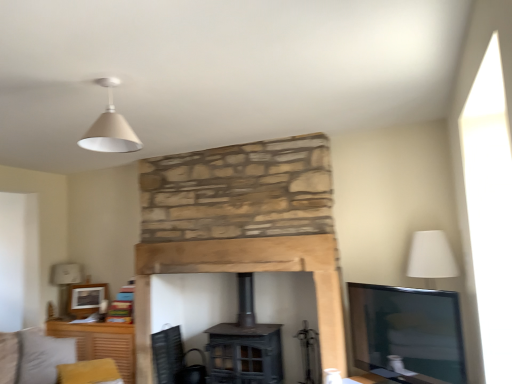
Where is `light gray fabric couch at lower left`? The image size is (512, 384). light gray fabric couch at lower left is located at coordinates (33, 356).

The height and width of the screenshot is (384, 512). Find the location of `matte wooden picture frame at upper left`. matte wooden picture frame at upper left is located at coordinates (86, 299).

Identify the location of matte white cone at upper center. The width and height of the screenshot is (512, 384). (110, 127).

This screenshot has width=512, height=384. Describe the element at coordinates (175, 359) in the screenshot. I see `black mesh swivel chair at lower left` at that location.

This screenshot has height=384, width=512. In order to click on white fabric lampshade at left in this screenshot , I will do `click(65, 282)`.

At what (x,y) coordinates should I click in order to perform the action: click on couch beneath the matte wooden picture frame at upper left (from a real-world perspective). Please return your answer as a coordinate pair (x, y). Looking at the image, I should click on (33, 356).

Is light gray fabric couch at lower left positioned far away from matte wooden picture frame at upper left?

No, light gray fabric couch at lower left is in close proximity to matte wooden picture frame at upper left.

Considering the sizes of light gray fabric couch at lower left and matte wooden picture frame at upper left in the image, is light gray fabric couch at lower left bigger or smaller than matte wooden picture frame at upper left?

light gray fabric couch at lower left is bigger than matte wooden picture frame at upper left.

Is light gray fabric couch at lower left oriented away from matte wooden picture frame at upper left?

No, light gray fabric couch at lower left is not facing away from matte wooden picture frame at upper left.

From a real-world perspective, is black mesh swivel chair at lower left above or below matte wooden picture frame at upper left?

From a real-world perspective, black mesh swivel chair at lower left is physically below matte wooden picture frame at upper left.

Is black mesh swivel chair at lower left touching matte wooden picture frame at upper left?

No, black mesh swivel chair at lower left is not making contact with matte wooden picture frame at upper left.

Considering the positions of points (168, 361) and (98, 284), is point (168, 361) closer to camera compared to point (98, 284)?

That is True.

This screenshot has height=384, width=512. Identify the location of swivel chair located below the white fabric lampshade at left (from the image's perspective). (175, 359).

Considering their positions, is white fabric lampshade at left located in front of or behind black mesh swivel chair at lower left?

white fabric lampshade at left is behind black mesh swivel chair at lower left.

Looking at this image, from a real-world perspective, which object stands above the other?

white fabric lampshade at left is physically above.

Choose the correct answer: Is white fabric lampshade at left inside matte white cone at upper center or outside it?

white fabric lampshade at left cannot be found inside matte white cone at upper center.

Can you tell me how much white fabric lampshade at left and matte white cone at upper center differ in facing direction?

white fabric lampshade at left and matte white cone at upper center are facing 83.6 degrees away from each other.

This screenshot has width=512, height=384. Find the location of `table lamp lying below the matte white cone at upper center (from the image's perspective)`. table lamp lying below the matte white cone at upper center (from the image's perspective) is located at coordinates (65, 282).

Is there a large distance between white fabric lampshade at left and matte white cone at upper center?

white fabric lampshade at left is far away from matte white cone at upper center.

You are a GUI agent. You are given a task and a screenshot of the screen. Output one action in this format:
    pyautogui.click(x=<x>, y=<y>)
    Task: Click on the lamp located above the black mesh swivel chair at lower left (from the image's perspective)
    This screenshot has width=512, height=384.
    Given the screenshot: What is the action you would take?
    pyautogui.click(x=110, y=127)

Considering the relative sizes of matte white cone at upper center and black mesh swivel chair at lower left in the image provided, is matte white cone at upper center shorter than black mesh swivel chair at lower left?

Yes, matte white cone at upper center is shorter than black mesh swivel chair at lower left.

From the image's perspective, between matte white cone at upper center and black mesh swivel chair at lower left, which one is located above?

matte white cone at upper center appears higher in the image.

Can you tell me how much matte white cone at upper center and black mesh swivel chair at lower left differ in facing direction?

83.7 degrees separate the facing orientations of matte white cone at upper center and black mesh swivel chair at lower left.

How much distance is there between black mesh swivel chair at lower left and matte white cone at upper center?

They are 2.37 meters apart.

Does point (156, 339) appear closer or farther from the camera than point (101, 138)?

Point (156, 339) is farther from the camera than point (101, 138).

Considering the relative sizes of black mesh swivel chair at lower left and matte white cone at upper center in the image provided, is black mesh swivel chair at lower left bigger than matte white cone at upper center?

Yes, black mesh swivel chair at lower left is bigger than matte white cone at upper center.

Is matte white cone at upper center located within black mesh swivel chair at lower left?

No, matte white cone at upper center is not surrounded by black mesh swivel chair at lower left.

In the scene shown: How many degrees apart are the facing directions of light gray fabric couch at lower left and black mesh swivel chair at lower left?

56.9 degrees.

From a real-world perspective, between light gray fabric couch at lower left and black mesh swivel chair at lower left, who is vertically lower?

black mesh swivel chair at lower left is physically lower.

From the picture: Which of these two, light gray fabric couch at lower left or black mesh swivel chair at lower left, is smaller?

With smaller size is black mesh swivel chair at lower left.

Can you confirm if light gray fabric couch at lower left is thinner than black mesh swivel chair at lower left?

Yes, light gray fabric couch at lower left is thinner than black mesh swivel chair at lower left.

Locate an element on the screen. couch on the right of the matte wooden picture frame at upper left is located at coordinates (33, 356).

Identify the location of picture frame above the black mesh swivel chair at lower left (from a real-world perspective). (86, 299).

Based on their spatial positions, is rustic wood fireplace at center or white fabric lampshade at left closer to matte white cone at upper center?

Among the two, rustic wood fireplace at center is located nearer to matte white cone at upper center.

Consider the image. Estimate the real-world distances between objects in this image. Which object is closer to black mesh swivel chair at lower left, rustic wood fireplace at center or light gray fabric couch at lower left?

light gray fabric couch at lower left lies closer to black mesh swivel chair at lower left than the other object.

When comparing their distances from black mesh swivel chair at lower left, does light gray fabric couch at lower left or rustic wood fireplace at center seem closer?

Among the two, light gray fabric couch at lower left is located nearer to black mesh swivel chair at lower left.

Estimate the real-world distances between objects in this image. Which object is closer to white fabric lampshade at left, matte wooden picture frame at upper left or matte white cone at upper center?

Among the two, matte wooden picture frame at upper left is located nearer to white fabric lampshade at left.

When comparing their distances from matte white cone at upper center, does light gray fabric couch at lower left or matte wooden picture frame at upper left seem closer?

light gray fabric couch at lower left lies closer to matte white cone at upper center than the other object.

Which object lies nearer to the anchor point matte wooden picture frame at upper left, matte white cone at upper center or white fabric lampshade at left?

white fabric lampshade at left.

When comparing their distances from rustic wood fireplace at center, does matte white cone at upper center or white fabric lampshade at left seem further?

white fabric lampshade at left.

In the scene shown: Looking at the image, which one is located further to light gray fabric couch at lower left, rustic wood fireplace at center or white fabric lampshade at left?

rustic wood fireplace at center.

Identify the location of picture frame located between white fabric lampshade at left and black mesh swivel chair at lower left in the left-right direction. (86, 299).

Where is `swivel chair between light gray fabric couch at lower left and matte wooden picture frame at upper left from front to back`? The height and width of the screenshot is (384, 512). swivel chair between light gray fabric couch at lower left and matte wooden picture frame at upper left from front to back is located at coordinates (175, 359).

Image resolution: width=512 pixels, height=384 pixels. What are the coordinates of `fireplace between matte white cone at upper center and black mesh swivel chair at lower left vertically` in the screenshot? It's located at (242, 225).

The height and width of the screenshot is (384, 512). I want to click on swivel chair between white fabric lampshade at left and rustic wood fireplace at center in the horizontal direction, so (175, 359).